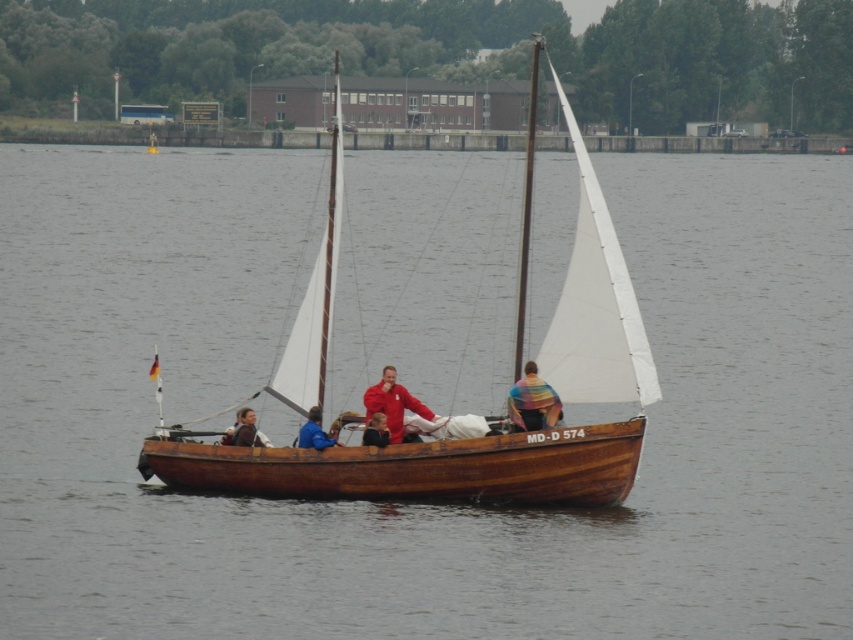
Does blue fabric jacket at center have a larger size compared to smooth brown wooden boat at center?

Yes, blue fabric jacket at center is bigger than smooth brown wooden boat at center.

Is point (299, 444) positioned after point (386, 422)?

Yes, point (299, 444) is farther from viewer.

This screenshot has height=640, width=853. Identify the location of blue fabric jacket at center. click(315, 432).

Is rainbow fabric at center above blue fabric jacket at center?

Yes.

Is the position of rainbow fabric at center more distant than that of blue fabric jacket at center?

Yes, rainbow fabric at center is further from the viewer.

Where is `rainbow fabric at center`? The height and width of the screenshot is (640, 853). rainbow fabric at center is located at coordinates (532, 401).

This screenshot has width=853, height=640. In order to click on rainbow fabric at center in this screenshot , I will do `click(532, 401)`.

Which is behind, point (233, 428) or point (375, 429)?

Positioned behind is point (233, 428).

Looking at this image, between brown leather jacket at center and smooth brown wooden boat at center, which one is positioned lower?

brown leather jacket at center

Identify the location of brown leather jacket at center. (244, 429).